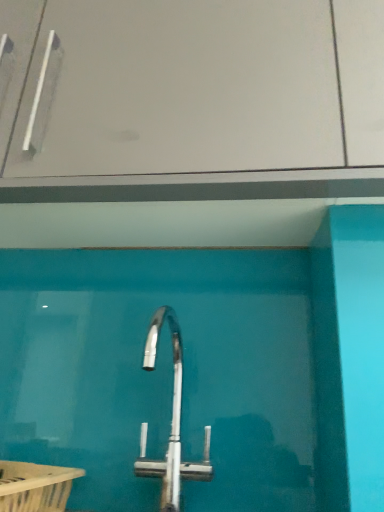
Question: Considering the relative sizes of white plastic bath at lower left and polished chrome tap at center in the image provided, is white plastic bath at lower left thinner than polished chrome tap at center?

Choices:
 (A) yes
 (B) no

Answer: (B)

Question: From a real-world perspective, is white plastic bath at lower left located beneath polished chrome tap at center?

Choices:
 (A) no
 (B) yes

Answer: (B)

Question: Considering the relative positions of white plastic bath at lower left and polished chrome tap at center in the image provided, is white plastic bath at lower left to the right of polished chrome tap at center from the viewer's perspective?

Choices:
 (A) no
 (B) yes

Answer: (A)

Question: From a real-world perspective, is white plastic bath at lower left on top of polished chrome tap at center?

Choices:
 (A) yes
 (B) no

Answer: (B)

Question: From the image's perspective, is white plastic bath at lower left located beneath polished chrome tap at center?

Choices:
 (A) no
 (B) yes

Answer: (B)

Question: Does point (26, 483) appear closer or farther from the camera than point (190, 462)?

Choices:
 (A) closer
 (B) farther

Answer: (A)

Question: Which is correct: white plastic bath at lower left is inside polished chrome tap at center, or outside of it?

Choices:
 (A) outside
 (B) inside

Answer: (A)

Question: Is white plastic bath at lower left in front of or behind polished chrome tap at center in the image?

Choices:
 (A) front
 (B) behind

Answer: (A)

Question: Based on their positions, is white plastic bath at lower left located to the left or right of polished chrome tap at center?

Choices:
 (A) left
 (B) right

Answer: (A)

Question: From a real-world perspective, is transparent glass door at center physically located above or below polished chrome tap at center?

Choices:
 (A) above
 (B) below

Answer: (A)

Question: Looking at the image, does transparent glass door at center seem bigger or smaller compared to polished chrome tap at center?

Choices:
 (A) big
 (B) small

Answer: (A)

Question: Considering their positions, is transparent glass door at center located in front of or behind polished chrome tap at center?

Choices:
 (A) behind
 (B) front

Answer: (A)

Question: Based on their positions, is transparent glass door at center located to the left or right of polished chrome tap at center?

Choices:
 (A) right
 (B) left

Answer: (B)

Question: Looking at their shapes, would you say white plastic bath at lower left is wider or thinner than transparent glass door at center?

Choices:
 (A) wide
 (B) thin

Answer: (B)

Question: Considering the relative positions of white plastic bath at lower left and transparent glass door at center in the image provided, is white plastic bath at lower left to the left or to the right of transparent glass door at center?

Choices:
 (A) left
 (B) right

Answer: (A)